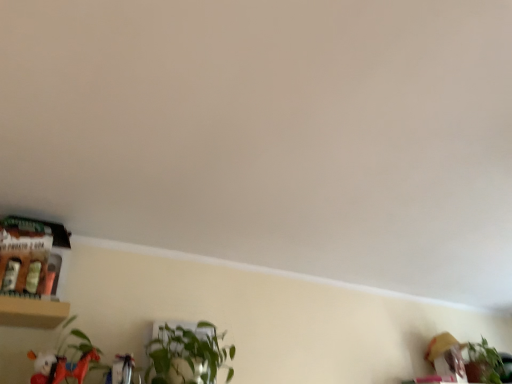
Question: Is point (38, 375) positioned closer to the camera than point (195, 372)?

Choices:
 (A) closer
 (B) farther

Answer: (A)

Question: In terms of width, does matte white plush at lower left look wider or thinner when compared to green leafy plant at center, positioned as the first houseplant in front-to-back order?

Choices:
 (A) thin
 (B) wide

Answer: (A)

Question: Estimate the real-world distances between objects in this image. Which object is farther from the matte white plush at lower left?

Choices:
 (A) green leafy plant at lower right, which ranks as the 2th houseplant in front-to-back order
 (B) green leafy plant at center, the first houseplant viewed from the left

Answer: (A)

Question: Estimate the real-world distances between objects in this image. Which object is closer to the green leafy plant at lower right, which is counted as the first houseplant, starting from the right?

Choices:
 (A) matte white plush at lower left
 (B) green leafy plant at center, the first houseplant viewed from the left

Answer: (B)